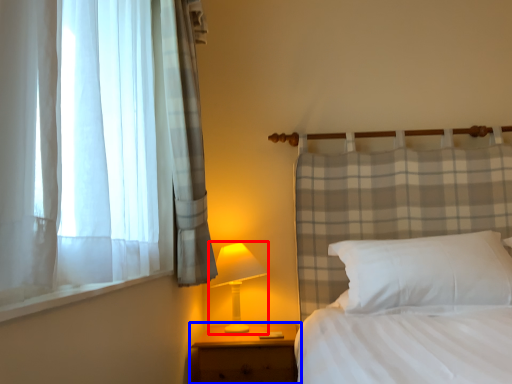
Question: Which object appears closest to the camera in this image, table lamp (highlighted by a red box) or nightstand (highlighted by a blue box)?

Choices:
 (A) table lamp
 (B) nightstand

Answer: (B)